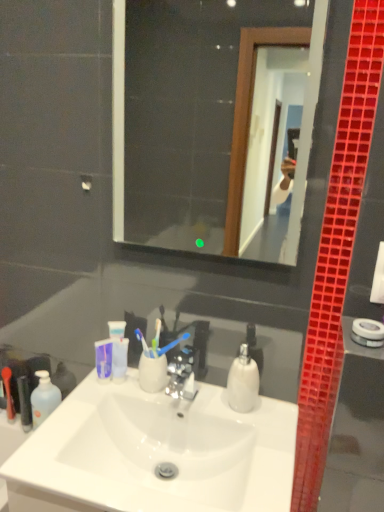
Question: From a real-world perspective, is black plastic tube at left, the second toiletry viewed from the left, physically located above or below transparent glass mirror at upper center?

Choices:
 (A) below
 (B) above

Answer: (A)

Question: Considering the positions of point (26, 408) and point (130, 83), is point (26, 408) closer or farther from the camera than point (130, 83)?

Choices:
 (A) farther
 (B) closer

Answer: (B)

Question: Which object is the closest to the white glossy sink at center?

Choices:
 (A) black plastic tube at left, the second toiletry viewed from the left
 (B) transparent glass mirror at upper center
 (C) white plastic towel bar at right
 (D) translucent plastic mouthwash at lower left
 (E) rubberized red toothbrush at lower left, marked as the 2th toiletry in a right-to-left arrangement

Answer: (D)

Question: Based on their relative distances, which object is nearer to the translucent plastic mouthwash at lower left?

Choices:
 (A) white plastic towel bar at right
 (B) transparent glass mirror at upper center
 (C) black plastic tube at left, the 1th toiletry when ordered from right to left
 (D) white glossy sink at center
 (E) rubberized red toothbrush at lower left, marked as the 2th toiletry in a right-to-left arrangement

Answer: (C)